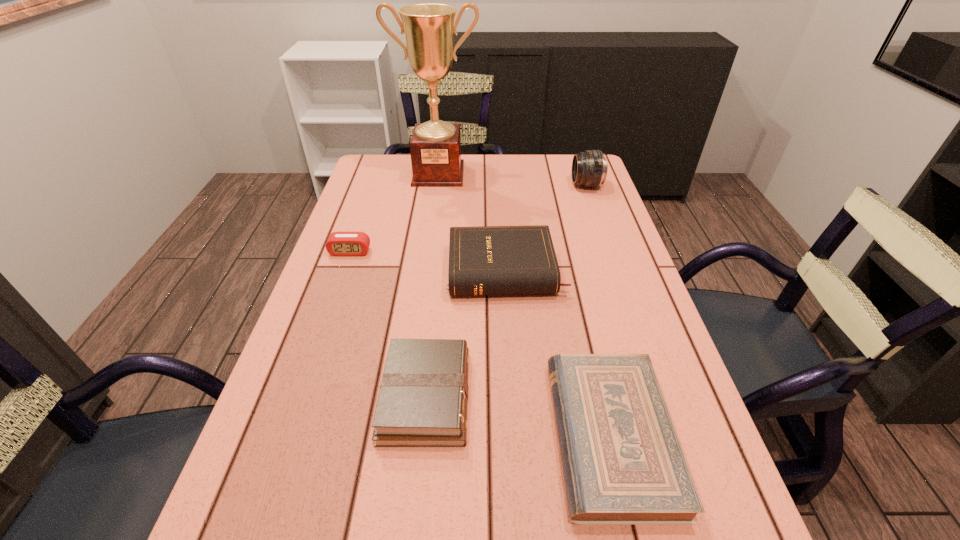
The height and width of the screenshot is (540, 960). Find the location of `trophy cup`. trophy cup is located at coordinates (435, 147).

This screenshot has width=960, height=540. What are the coordinates of `telephoto lens` in the screenshot? It's located at (589, 168).

Identify the location of the third tallest object. (486, 260).

Identify the location of the tallest Bible. This screenshot has height=540, width=960. (486, 260).

Identify the location of the second shortest Bible. This screenshot has width=960, height=540. (423, 400).

Where is `alarm clock`? This screenshot has width=960, height=540. alarm clock is located at coordinates (339, 243).

Find the location of a particular element. This screenshot has width=960, height=540. the shortest object is located at coordinates (623, 464).

Where is `free space located on the plaque of the trophy cup`? free space located on the plaque of the trophy cup is located at coordinates (431, 227).

This screenshot has height=540, width=960. I want to click on free spot located 0.280m at the front element of the fifth shortest object, so click(485, 185).

Image resolution: width=960 pixels, height=540 pixels. I want to click on free spot located at the front element of the fifth shortest object, so click(538, 185).